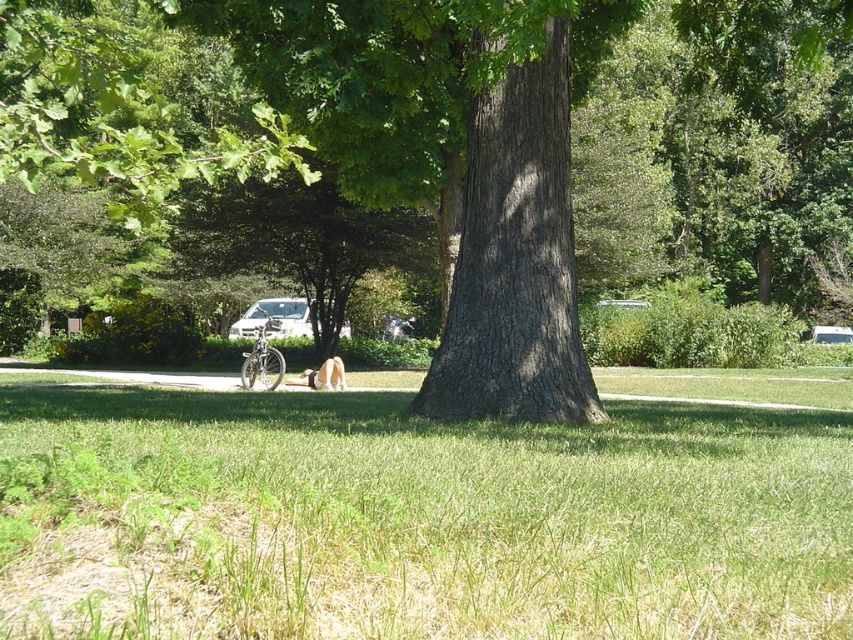
Question: Is white matte car at center positioned behind light brown fur at center?

Choices:
 (A) no
 (B) yes

Answer: (B)

Question: From the image, what is the correct spatial relationship of green grass at center in relation to white matte car at center?

Choices:
 (A) above
 (B) below

Answer: (B)

Question: Which is farther from the green grass at center?

Choices:
 (A) white matte car at center
 (B) light brown fur at center

Answer: (A)

Question: Which object is the farthest from the white matte car at center?

Choices:
 (A) light brown fur at center
 (B) green grass at center

Answer: (B)

Question: Can you confirm if green grass at center is smaller than light brown fur at center?

Choices:
 (A) no
 (B) yes

Answer: (A)

Question: Which point is farther to the camera?

Choices:
 (A) (248, 336)
 (B) (189, 460)
 (C) (326, 365)

Answer: (A)